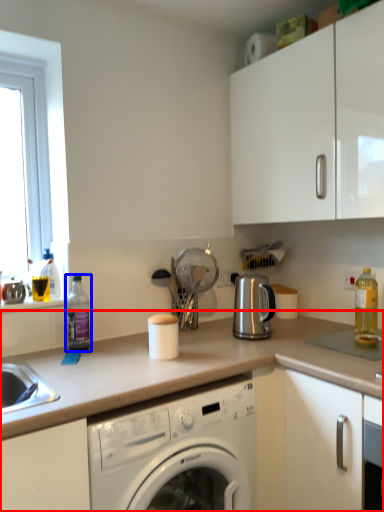
Question: Which object is further to the camera taking this photo, countertop (highlighted by a red box) or bottle (highlighted by a blue box)?

Choices:
 (A) countertop
 (B) bottle

Answer: (B)